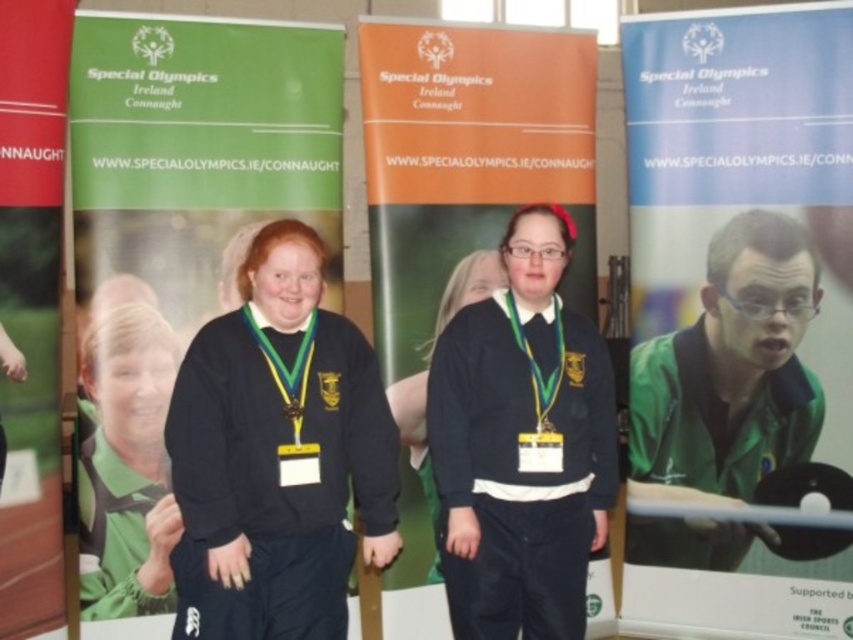
You are a photographer at the Special Olympics Ireland Connaught event. You need to capture a photo where the green jersey at center is visible without being blocked by the gold metallic medal at center. Based on their positions, is this possible?

The green jersey at center is positioned under the gold metallic medal at center, so the medal will block part of the jersey in the photo.

You are a photographer standing 10 feet away from the two people in the image. You want to take a closeup photo of the matte black sweater at center and the gold shiny medal at center. Can you focus on both objects clearly in the same photo?

The matte black sweater at center is 32.29 inches from the gold shiny medal at center. Since the distance between them is less than 10 feet, you can focus on both objects clearly in the same photo.